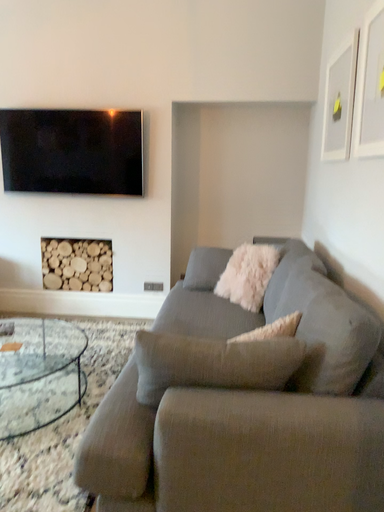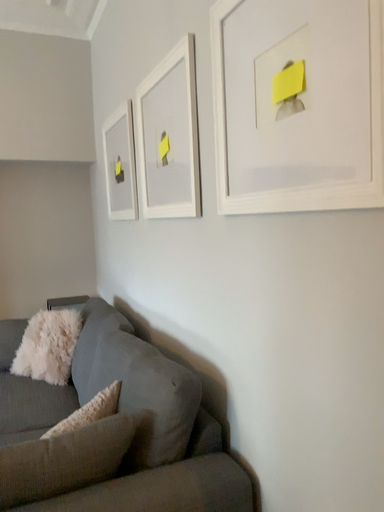
Question: How did the camera likely rotate when shooting the video?

Choices:
 (A) rotated right
 (B) rotated left

Answer: (A)